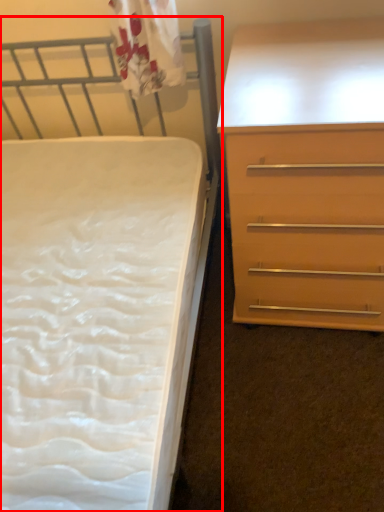
Question: In this image, where is bed (annotated by the red box) located relative to chest of drawers?

Choices:
 (A) left
 (B) right

Answer: (A)